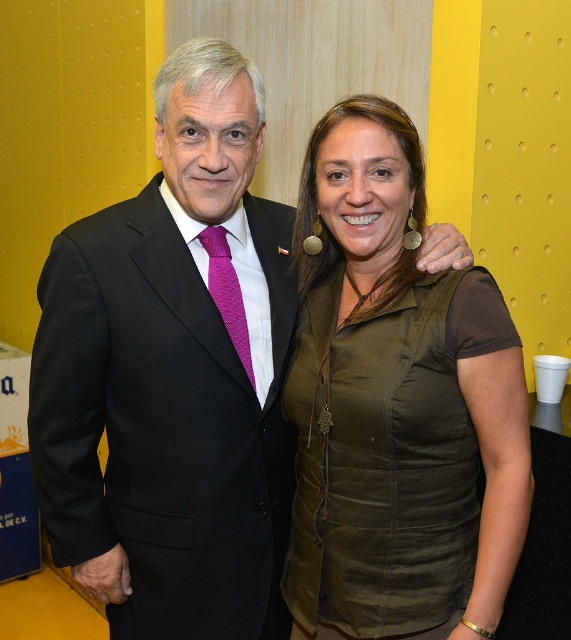
You are a fashion designer observing the two outfits in the image. The green textured vest at center and the black wool suit at center. Which of the two items has a taller silhouette?

The green textured vest at center has a greater height compared to the black wool suit at center, so the green textured vest at center has a taller silhouette.